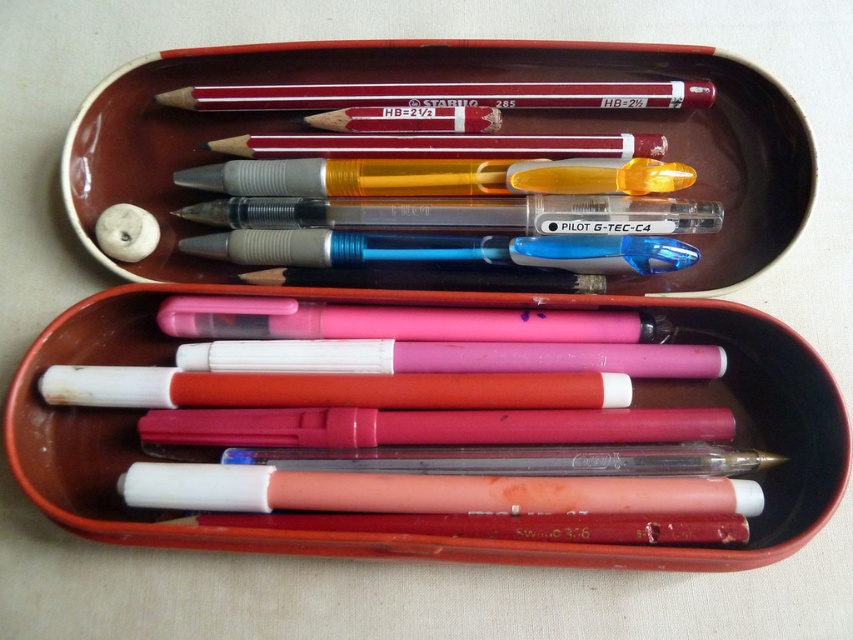
Between matte red pencil at upper center and white matte eraser at upper left, which one is positioned lower?

Positioned lower is white matte eraser at upper left.

Is matte red pencil at upper center to the right of white matte eraser at upper left from the viewer's perspective?

Correct, you'll find matte red pencil at upper center to the right of white matte eraser at upper left.

Does point (187, 104) lie behind point (129, 204)?

That is True.

The width and height of the screenshot is (853, 640). Find the location of `matte red pencil at upper center`. matte red pencil at upper center is located at coordinates click(444, 96).